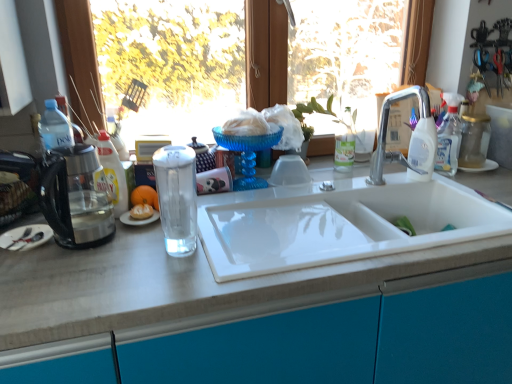
Locate an element on the screen. This screenshot has height=384, width=512. vacant space behind silver metallic faucet at upper right is located at coordinates tap(370, 174).